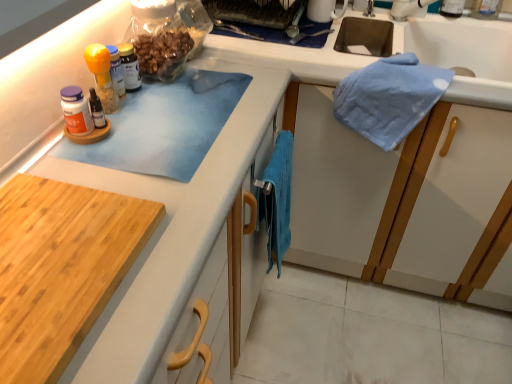
Question: Can you confirm if blue cotton towel at center is smaller than blue fabric towel at upper right?

Choices:
 (A) yes
 (B) no

Answer: (A)

Question: Does blue cotton towel at center have a larger size compared to blue fabric towel at upper right?

Choices:
 (A) yes
 (B) no

Answer: (B)

Question: Is blue cotton towel at center to the right of blue fabric towel at upper right from the viewer's perspective?

Choices:
 (A) yes
 (B) no

Answer: (B)

Question: From the image's perspective, is blue cotton towel at center located beneath blue fabric towel at upper right?

Choices:
 (A) yes
 (B) no

Answer: (A)

Question: Is blue cotton towel at center oriented away from blue fabric towel at upper right?

Choices:
 (A) no
 (B) yes

Answer: (A)

Question: From a real-world perspective, does blue cotton towel at center stand above blue fabric towel at upper right?

Choices:
 (A) yes
 (B) no

Answer: (B)

Question: From a real-world perspective, does blue fabric towel at upper right sit lower than translucent plastic bottle at center?

Choices:
 (A) yes
 (B) no

Answer: (A)

Question: Is blue fabric towel at upper right oriented towards translucent plastic bottle at center?

Choices:
 (A) yes
 (B) no

Answer: (B)

Question: Is blue fabric towel at upper right located outside translucent plastic bottle at center?

Choices:
 (A) yes
 (B) no

Answer: (A)

Question: Does blue fabric towel at upper right have a smaller size compared to translucent plastic bottle at center?

Choices:
 (A) no
 (B) yes

Answer: (A)

Question: Can you confirm if blue fabric towel at upper right is shorter than translucent plastic bottle at center?

Choices:
 (A) no
 (B) yes

Answer: (A)

Question: From the image's perspective, does blue fabric towel at upper right appear lower than translucent plastic bottle at center?

Choices:
 (A) no
 (B) yes

Answer: (A)

Question: Can you confirm if blue fabric towel at upper right is wider than wooden cutting board at lower left?

Choices:
 (A) yes
 (B) no

Answer: (A)